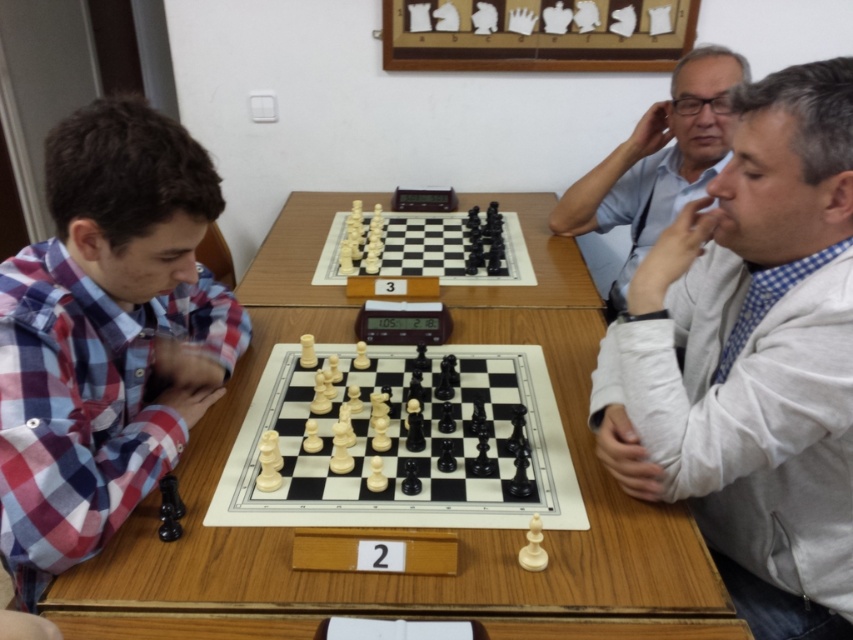
You are a photographer trying to capture a closeup of the plaid fabric shirt at left and the white plastic chess pieces at center. Which object should you zoom in on to ensure both are in focus without moving the camera?

The plaid fabric shirt at left is bigger than the white plastic chess pieces at center, so you should zoom in on the plaid fabric shirt at left to ensure both are in focus without moving the camera.

You are a chess player trying to place a large trophy on the table. The trophy requires a space of 1 meter by 1 meter. Given the wooden table at center and the white plastic chessboard at center, can you determine if there is enough space on the table to place the trophy without moving the chessboard?

The wooden table at center is larger in size than the white plastic chessboard at center. Since the table is bigger, there might be enough space around the chessboard to place the trophy. However, the exact dimensions of the table and the trophy are needed to confirm, but based on the information provided, the table could accommodate the trophy if positioned appropriately.

You are a photographer trying to capture a closeup of the plaid fabric shirt at left and the white plastic chess pieces at center. Which object should you focus on first if you want to ensure both are in focus without adjusting the camera settings?

The plaid fabric shirt at left is taller than the white plastic chess pieces at center, so focusing on the plaid fabric shirt at left first will help ensure both are in focus since it is larger in the frame.